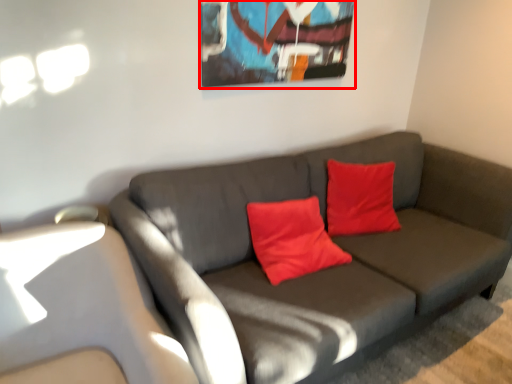
Question: From the image's perspective, what is the correct spatial relationship of picture frame (annotated by the red box) in relation to studio couch?

Choices:
 (A) above
 (B) below

Answer: (A)